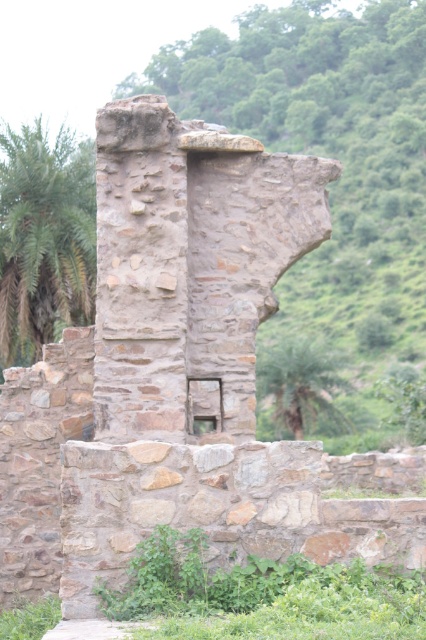
You are standing at point A with coordinates (x=74, y=305) and want to reach the rectangular opening in the ancient stone ruins. The path is clear except for a small stream flowing between you and the opening. If the stream is 296.28 feet wide, can you safely cross it without getting wet?

The distance between point A at coordinates (x=74, y=305) and the rectangular opening is 296.28 feet. Since the stream is as wide as this distance, you would need to find an alternative path or a bridge to cross safely without getting wet.